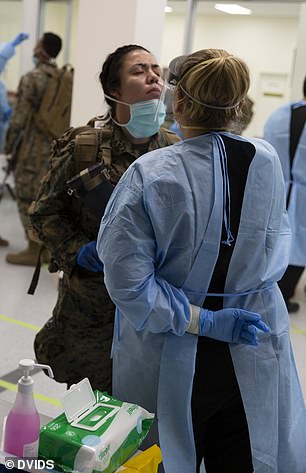
The height and width of the screenshot is (473, 306). Identify the location of floor. (35, 302), (11, 359), (297, 346).